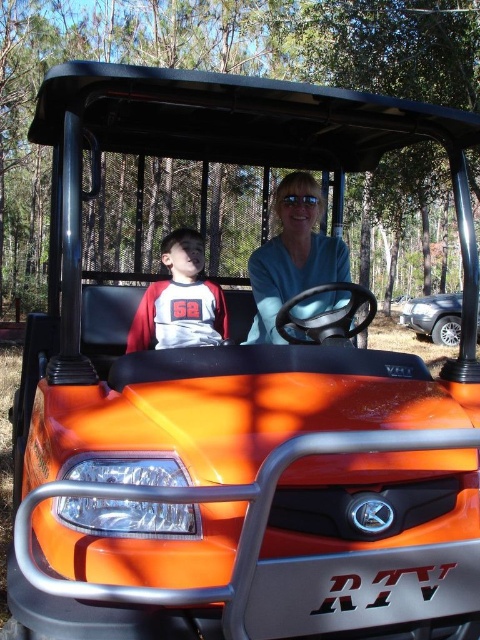
Question: Does red jersey at center have a larger size compared to silver metallic suv at right?

Choices:
 (A) yes
 (B) no

Answer: (A)

Question: Considering the real-world distances, which object is farthest from the blue matte shirt at center?

Choices:
 (A) red jersey at center
 (B) silver metallic suv at right

Answer: (B)

Question: Observing the image, what is the correct spatial positioning of blue matte shirt at center in reference to red jersey at center?

Choices:
 (A) above
 (B) below

Answer: (A)

Question: Which object appears closest to the camera in this image?

Choices:
 (A) blue matte shirt at center
 (B) red jersey at center
 (C) silver metallic suv at right

Answer: (A)

Question: Estimate the real-world distances between objects in this image. Which object is closer to the red jersey at center?

Choices:
 (A) silver metallic suv at right
 (B) blue matte shirt at center

Answer: (B)

Question: Does blue matte shirt at center appear on the right side of red jersey at center?

Choices:
 (A) yes
 (B) no

Answer: (A)